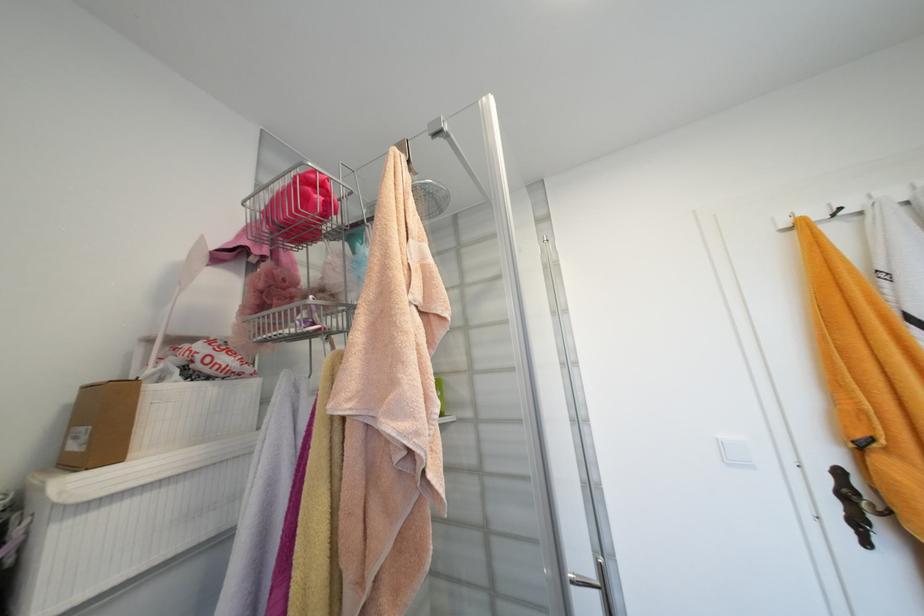
Identify the location of dark door handle. The image size is (924, 616). (596, 585).